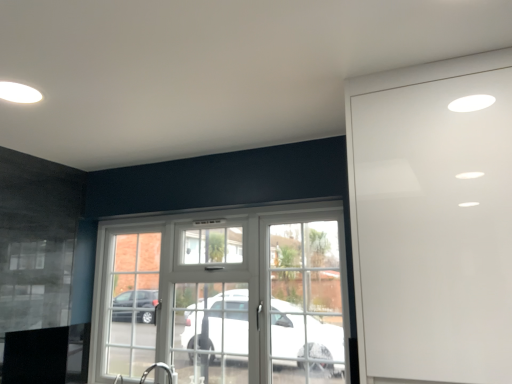
Question: In terms of size, does white glass door at center appear bigger or smaller than white glossy cabinet at right?

Choices:
 (A) small
 (B) big

Answer: (A)

Question: From a real-world perspective, is white glass door at center above or below white glossy cabinet at right?

Choices:
 (A) below
 (B) above

Answer: (A)

Question: Is white glass door at center taller or shorter than white glossy cabinet at right?

Choices:
 (A) tall
 (B) short

Answer: (B)

Question: From the image's perspective, relative to white glass door at center, is white glossy cabinet at right above or below?

Choices:
 (A) above
 (B) below

Answer: (A)

Question: In the image, is white glossy cabinet at right positioned in front of or behind white glass door at center?

Choices:
 (A) front
 (B) behind

Answer: (A)

Question: Based on their sizes in the image, would you say white glossy cabinet at right is bigger or smaller than white glass door at center?

Choices:
 (A) big
 (B) small

Answer: (A)

Question: Is white glossy cabinet at right spatially inside white glass door at center, or outside of it?

Choices:
 (A) inside
 (B) outside

Answer: (B)